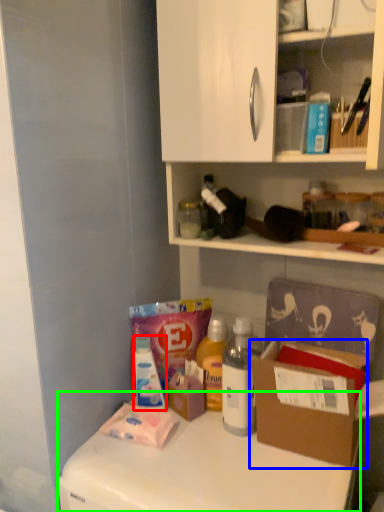
Question: Based on their relative distances, which object is nearer to bottle (highlighted by a red box)? Choose from cardboard box (highlighted by a blue box) and counter top (highlighted by a green box).

Choices:
 (A) cardboard box
 (B) counter top

Answer: (B)